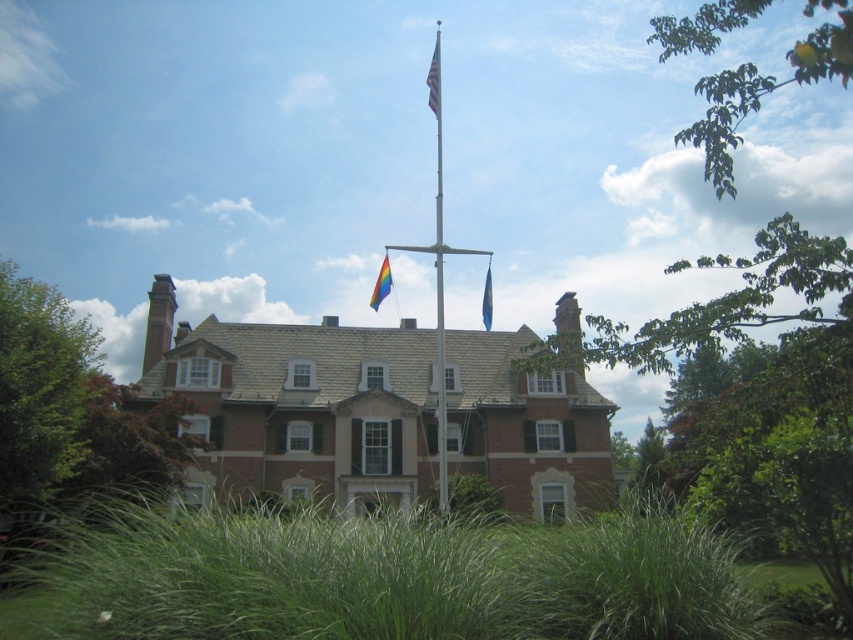
Question: Which object is farther from the camera taking this photo?

Choices:
 (A) silver metallic flag pole at center
 (B) american flag at center
 (C) blue fabric flag at upper center

Answer: (B)

Question: Which point is farther to the camera?

Choices:
 (A) (480, 312)
 (B) (189, 540)

Answer: (A)

Question: Which object is positioned farthest from the green grass at lower center?

Choices:
 (A) rainbow fabric flag at center
 (B) silver metallic flag pole at center

Answer: (A)

Question: Is silver metallic flag pole at center to the left of american flag at center from the viewer's perspective?

Choices:
 (A) no
 (B) yes

Answer: (B)

Question: Can you confirm if american flag at center is positioned to the left of blue fabric flag at upper center?

Choices:
 (A) no
 (B) yes

Answer: (B)

Question: Can you confirm if silver metallic flag pole at center is bigger than rainbow fabric flag at center?

Choices:
 (A) no
 (B) yes

Answer: (B)